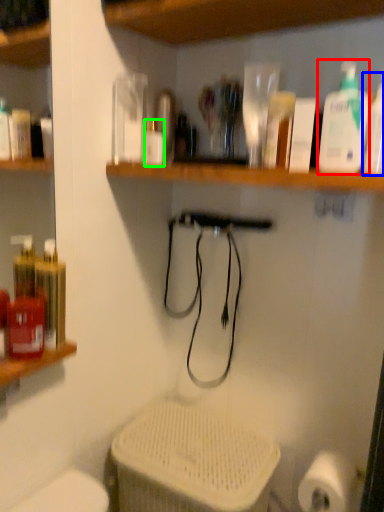
Question: Estimate the real-world distances between objects in this image. Which object is farther from cleaning product (highlighted by a red box), cleaning product (highlighted by a blue box) or bottle (highlighted by a green box)?

Choices:
 (A) cleaning product
 (B) bottle

Answer: (B)